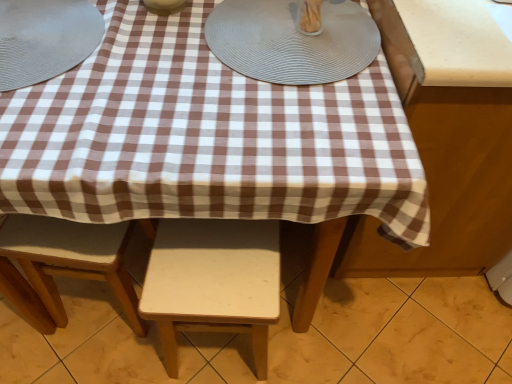
Question: Based on their sizes in the image, would you say matte ceramic bowl at upper center, which ranks as the 2th tableware in left-to-right order, is bigger or smaller than brown checkered tablecloth at right?

Choices:
 (A) small
 (B) big

Answer: (A)

Question: Would you say matte ceramic bowl at upper center, which ranks as the 2th tableware in left-to-right order, is to the left or to the right of brown checkered tablecloth at right in the picture?

Choices:
 (A) left
 (B) right

Answer: (A)

Question: Which of these objects is positioned closest to the matte ceramic bowl at upper center, the second tableware when ordered from right to left?

Choices:
 (A) matte gray placemat at upper left, which ranks as the first tableware in left-to-right order
 (B) brown checkered tablecloth at right
 (C) gray textured placemat at upper center
 (D) light wood stool at lower center, placed as the 2th stool when sorted from right to left
 (E) white matte stool at center, which ranks as the 2th stool in left-to-right order

Answer: (A)

Question: Based on their relative distances, which object is nearer to the brown checkered tablecloth at right?

Choices:
 (A) white matte stool at center, which ranks as the 2th stool in left-to-right order
 (B) clear glass container at upper center, which is counted as the 3th tableware, starting from the left
 (C) light wood stool at lower center, the 1th stool positioned from the left
 (D) matte gray placemat at upper left, which is the 3th tableware in right-to-left order
 (E) matte ceramic bowl at upper center, the second tableware when ordered from right to left

Answer: (B)